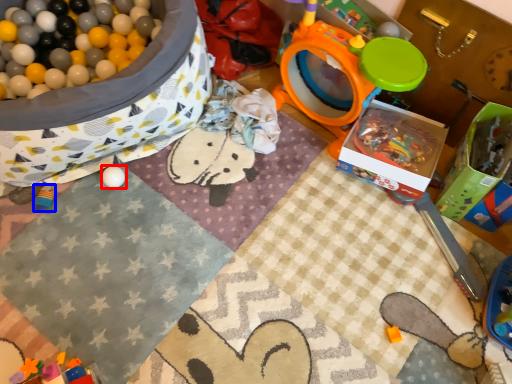
Question: Which object appears closest to the camera in this image, toy (highlighted by a red box) or toy (highlighted by a blue box)?

Choices:
 (A) toy
 (B) toy

Answer: (B)